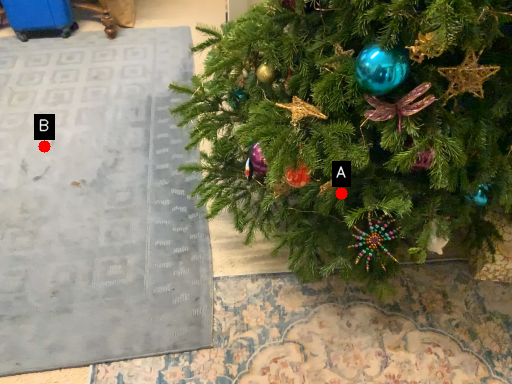
Question: Two points are circled on the image, labeled by A and B beside each circle. Which point is closer to the camera taking this photo?

Choices:
 (A) A is closer
 (B) B is closer

Answer: (A)